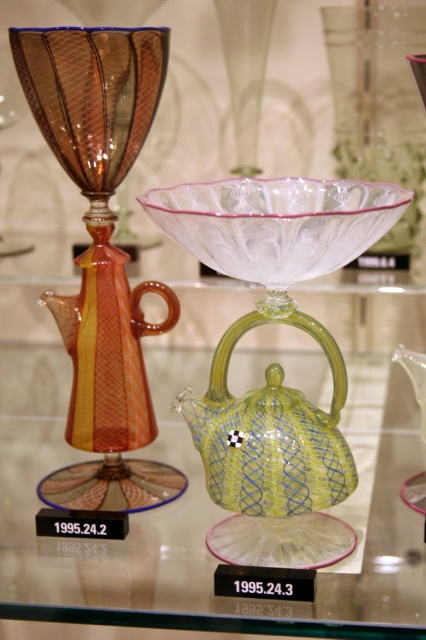
Based on the photo, you are an art curator arranging a display. You have an amber glass teapot at left and a transparent glass bowl at upper center. Which object has a smaller width?

The amber glass teapot at left has a lesser width compared to the transparent glass bowl at upper center.

You are a museum curator arranging an exhibition. You need to place a new item between the amber glass teapot at left and the transparent glass bowl at upper center. Where should you position it to maintain the vertical arrangement?

The amber glass teapot at left is below the transparent glass bowl at upper center, so placing the new item between them would require positioning it above the teapot but below the bowl to maintain the vertical arrangement.